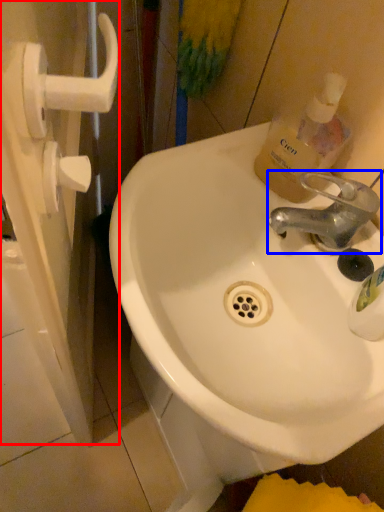
Question: Which of the following is the closest to the observer, screen door (highlighted by a red box) or tap (highlighted by a blue box)?

Choices:
 (A) screen door
 (B) tap

Answer: (A)